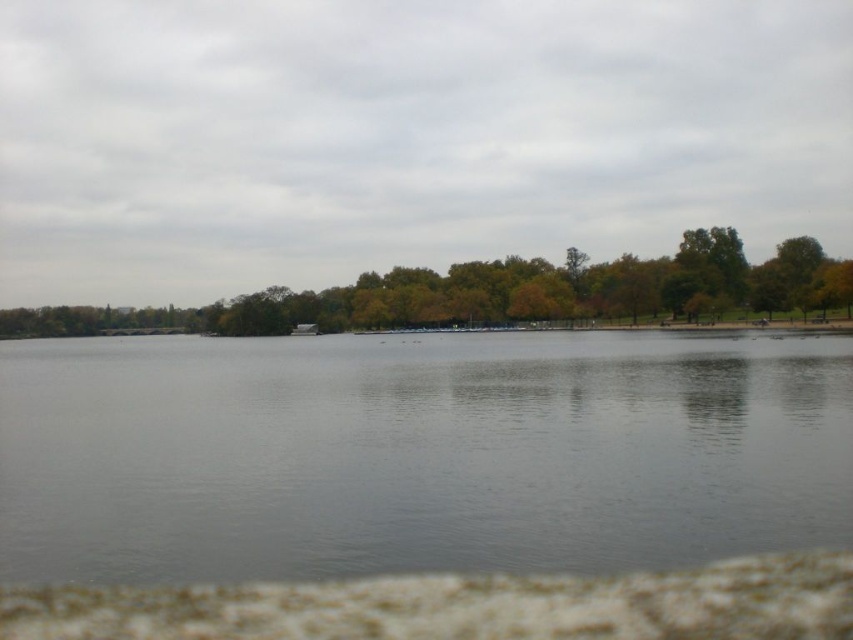
Question: Which of the following is the closest to the observer?

Choices:
 (A) (769, 269)
 (B) (718, 486)

Answer: (B)

Question: Is gray water at center closer to the viewer compared to green leafy tree at center?

Choices:
 (A) yes
 (B) no

Answer: (A)

Question: Does gray water at center appear on the left side of green leafy tree at center?

Choices:
 (A) no
 (B) yes

Answer: (A)

Question: Is gray water at center below green leafy tree at center?

Choices:
 (A) yes
 (B) no

Answer: (A)

Question: Which point is closer to the camera?

Choices:
 (A) (448, 301)
 (B) (491, 456)

Answer: (B)